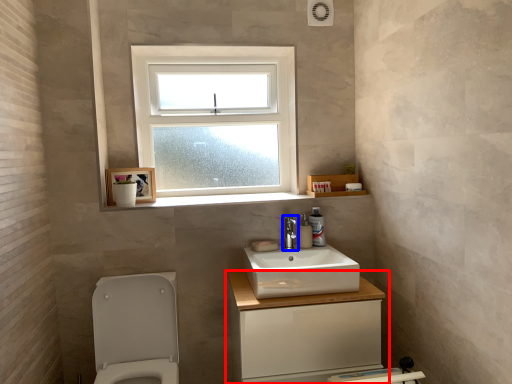
Question: Which of the following is the farthest to the observer, bathroom cabinet (highlighted by a red box) or tap (highlighted by a blue box)?

Choices:
 (A) bathroom cabinet
 (B) tap

Answer: (B)